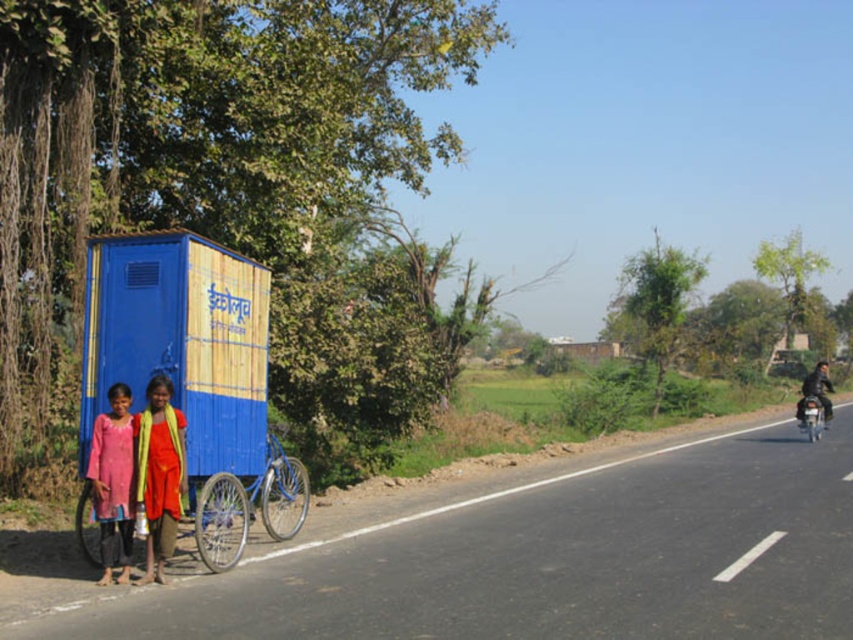
You are a photographer trying to capture a wide shot of the scene. You notice the pink cotton dress at lower left and the blue matte bicycle at center. Which object would require you to adjust your camera angle to include its full width in the frame?

The pink cotton dress at lower left has a larger width than the blue matte bicycle at center, so you would need to adjust your camera angle to include its full width in the frame.

You are a photographer trying to capture both the pink cotton dress at lower left and the blue matte bicycle at center in a single frame. Which object should you focus on first if you want to ensure both are in focus, considering their sizes in the frame?

The pink cotton dress at lower left has a greater height compared to the blue matte bicycle at center. Therefore, focusing on the pink cotton dress at lower left first would help ensure both are in focus since it is larger in the frame.